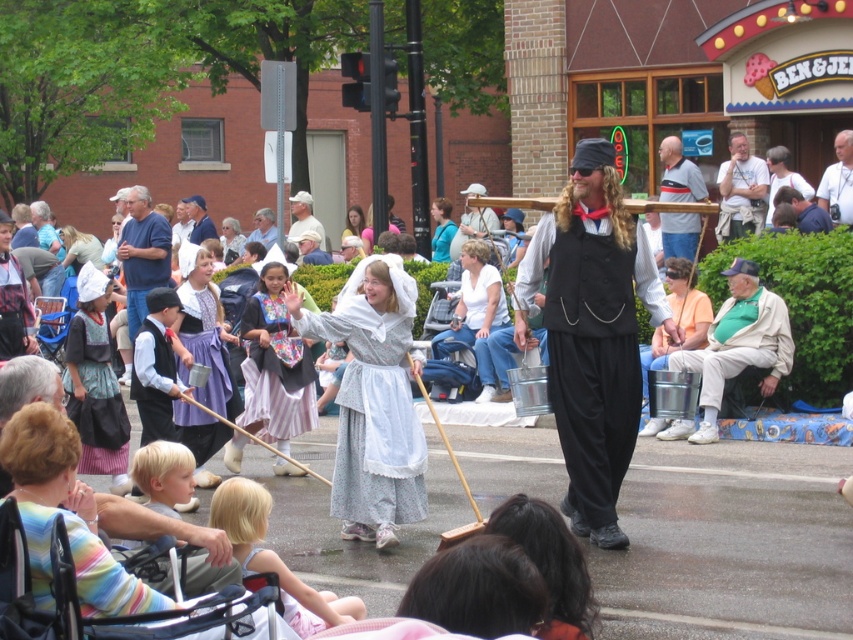
You are a photographer standing in the middle of the street during the parade. You notice the white lace fabric dress at center and the white fabric shirt at upper right. Which clothing item is closer to you?

The white lace fabric dress at center is closer to you because it is in front of the white fabric shirt at upper right.

Looking at this image, you are a photographer standing at the edge of the street. You want to take a photo that includes both the embroidered fabric dress at center and the white fabric shirt at upper right. The camera you are using has a maximum focus range of 7 meters. Will you be able to capture both subjects in focus?

The distance between the embroidered fabric dress at center and the white fabric shirt at upper right is 7.07 meters, which exceeds the camera maximum focus range of 7 meters. Therefore, you cannot capture both subjects in focus.